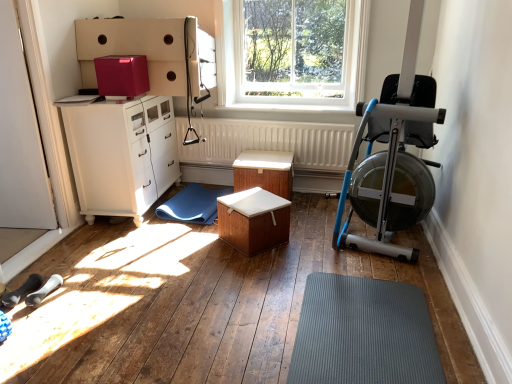
Image resolution: width=512 pixels, height=384 pixels. In order to click on vacant region above gray rubber mat at lower center, the first doormat positioned from the front (from a real-world perspective) in this screenshot , I will do `click(346, 347)`.